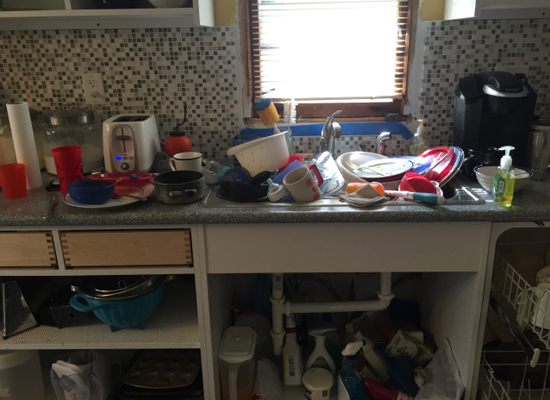
Where is `tile backsplash`? tile backsplash is located at coordinates (27, 62), (473, 39), (342, 147).